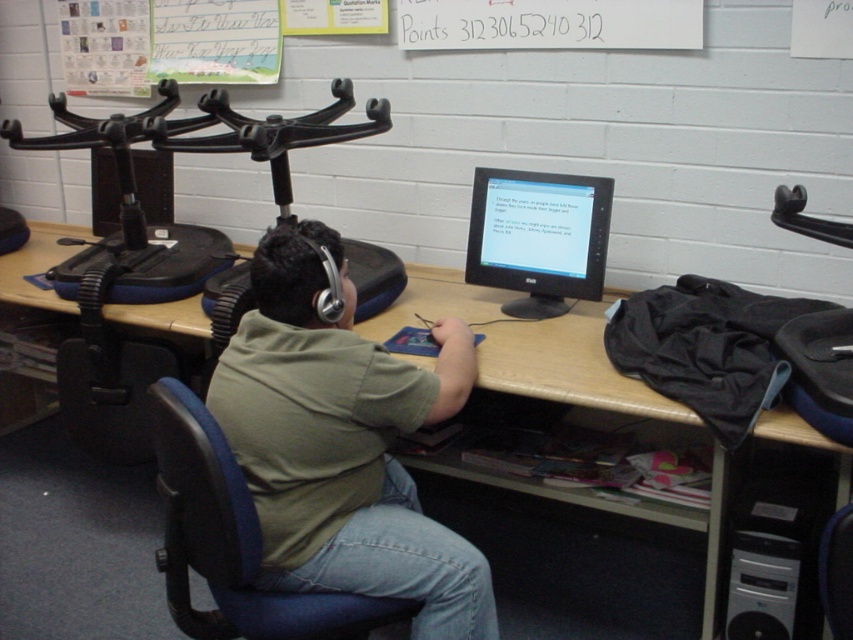
Question: Which object is the farthest from the black matte monitor at center?

Choices:
 (A) wooden at center
 (B) white plastic computer tower at lower right
 (C) blue fabric chair at lower center

Answer: (C)

Question: Can you confirm if blue fabric swivel chair at center is positioned to the left of black matte monitor at center?

Choices:
 (A) no
 (B) yes

Answer: (B)

Question: Is blue fabric swivel chair at center above black matte monitor at center?

Choices:
 (A) yes
 (B) no

Answer: (B)

Question: Is wooden at center to the left of black matte monitor at center from the viewer's perspective?

Choices:
 (A) no
 (B) yes

Answer: (A)

Question: Which object is the farthest from the black matte monitor at center?

Choices:
 (A) wooden at center
 (B) blue fabric swivel chair at center
 (C) green cotton shirt at center

Answer: (B)

Question: Considering the real-world distances, which object is farthest from the black matte monitor at center?

Choices:
 (A) wooden at center
 (B) green cotton shirt at center
 (C) blue fabric chair at lower center
 (D) blue fabric swivel chair at center

Answer: (C)